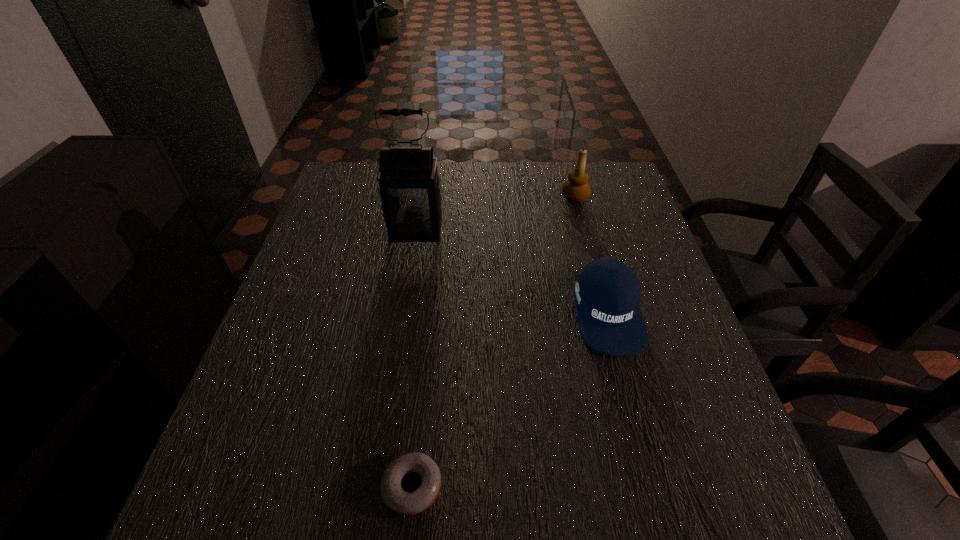
Find the location of a particular element. The image size is (960, 540). blank space at the far left corner is located at coordinates (344, 186).

Locate an element on the screen. This screenshot has height=540, width=960. vacant space at the near left corner of the desktop is located at coordinates coord(250,531).

Find the location of a particular element. This screenshot has width=960, height=540. vacant space at the far right corner of the desktop is located at coordinates (617, 198).

At what (x,y) coordinates should I click in order to perform the action: click on empty space that is in between the second tallest object and the second farthest object. Please return your answer as a coordinate pair (x, y). Looking at the image, I should click on (495, 214).

At what (x,y) coordinates should I click in order to perform the action: click on empty location between the third tallest object and the tallest object. Please return your answer as a coordinate pair (x, y). Looking at the image, I should click on (512, 272).

Identify the location of free space between the farthest object and the third nearest object. This screenshot has height=540, width=960. (495, 214).

Where is `empty space that is in between the doughnut and the farthest object`? The image size is (960, 540). empty space that is in between the doughnut and the farthest object is located at coordinates (493, 342).

You are a GUI agent. You are given a task and a screenshot of the screen. Output one action in this format:
    pyautogui.click(x=<x>, y=<y>)
    Task: Click on the empty space that is in between the farthest object and the tallest object
    Image resolution: width=960 pixels, height=540 pixels.
    Given the screenshot: What is the action you would take?
    pyautogui.click(x=495, y=214)

I want to click on vacant area that lies between the tallest object and the nearest object, so click(414, 359).

The width and height of the screenshot is (960, 540). I want to click on vacant point located between the tallest object and the second shortest object, so click(x=512, y=272).